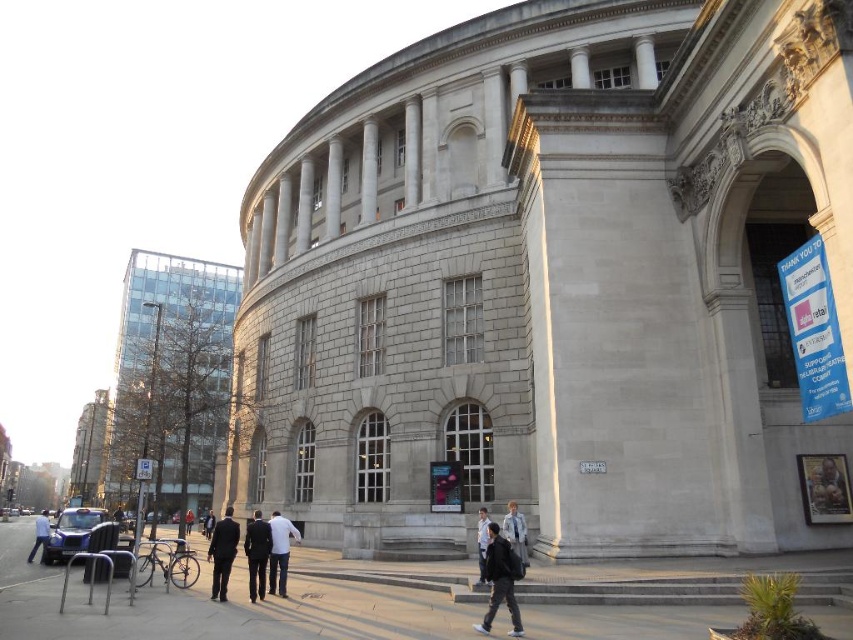
Between point (521, 550) and point (39, 525), which one is positioned behind?

The point (39, 525) is more distant.

Between point (514, 529) and point (44, 534), which one is positioned in front?

Point (514, 529) is more forward.

Locate an element on the screen. This screenshot has width=853, height=640. light blue fabric jacket at center is located at coordinates (515, 531).

Is sandy beige pavement at lower center positioned behind black suit at lower left?

No, it is in front of black suit at lower left.

Can you confirm if sandy beige pavement at lower center is positioned above black suit at lower left?

Incorrect, sandy beige pavement at lower center is not positioned above black suit at lower left.

Who is more forward, [120,596] or [218,573]?

Point [120,596] is more forward.

Where is `sandy beige pavement at lower center`? sandy beige pavement at lower center is located at coordinates pyautogui.click(x=216, y=608).

Does white matte shirt at center have a greater height compared to dark blue jeans at lower left?

In fact, white matte shirt at center may be shorter than dark blue jeans at lower left.

Does white matte shirt at center have a lesser height compared to dark blue jeans at lower left?

Yes.

Is point (287, 524) closer to viewer compared to point (33, 540)?

Yes, it is.

At what (x,y) coordinates should I click in order to perform the action: click on white matte shirt at center. Please return your answer as a coordinate pair (x, y). This screenshot has width=853, height=640. Looking at the image, I should click on (279, 552).